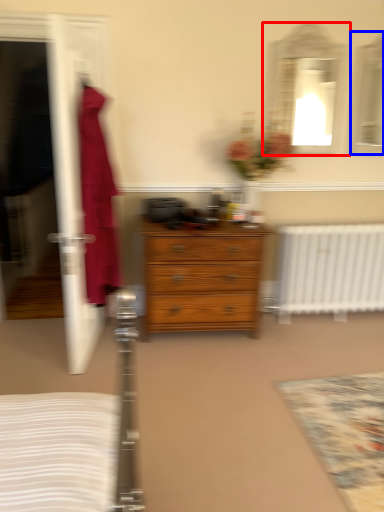
Question: Which of the following is the closest to the observer, mirror (highlighted by a red box) or mirror (highlighted by a blue box)?

Choices:
 (A) mirror
 (B) mirror

Answer: (A)